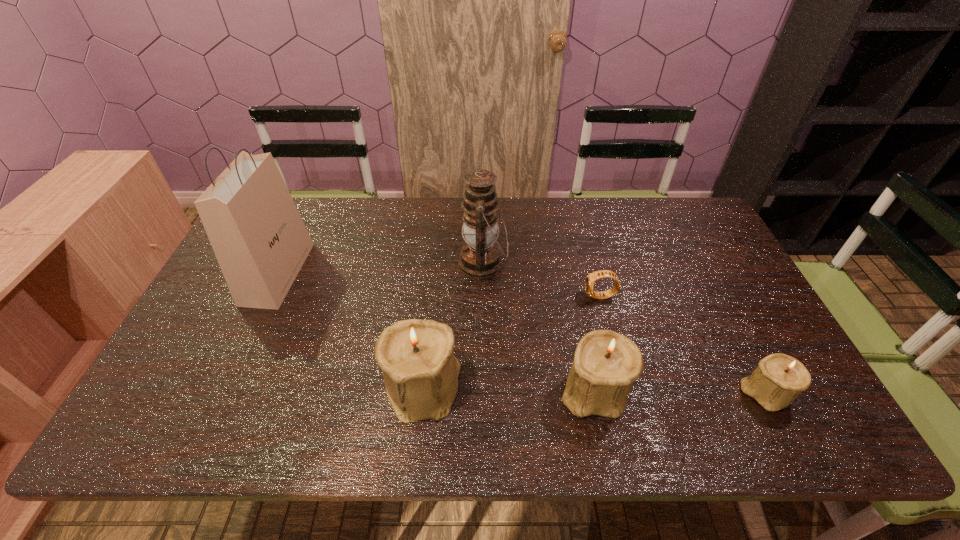
Find the location of `vacant space situated on the right of the second tallest candle_holder`. vacant space situated on the right of the second tallest candle_holder is located at coordinates (759, 389).

The image size is (960, 540). What are the coordinates of `free space located on the back of the rightmost candle_holder` in the screenshot? It's located at (704, 271).

You are a GUI agent. You are given a task and a screenshot of the screen. Output one action in this format:
    pyautogui.click(x=<x>, y=<y>)
    Task: Click on the vacant area situated 0.090m on the front of the fifth shortest object
    Image resolution: width=960 pixels, height=540 pixels.
    Given the screenshot: What is the action you would take?
    pyautogui.click(x=483, y=311)

You are a GUI agent. You are given a task and a screenshot of the screen. Output one action in this format:
    pyautogui.click(x=<x>, y=<y>)
    Task: Click on the vacant space located on the right of the leftmost object
    The image size is (960, 540).
    Given the screenshot: What is the action you would take?
    pyautogui.click(x=339, y=273)

Locate an element on the screen. free spot located 0.140m on the face of the watch is located at coordinates (535, 297).

I want to click on vacant space located 0.390m on the face of the watch, so click(446, 297).

Locate an element on the screen. This screenshot has width=960, height=540. free space located on the face of the watch is located at coordinates pos(446,297).

Identify the location of object present at the far edge. (480, 257).

Find the location of a particular element. object positioned at the left edge is located at coordinates (260, 241).

In order to click on object present at the right edge in this screenshot , I will do `click(778, 379)`.